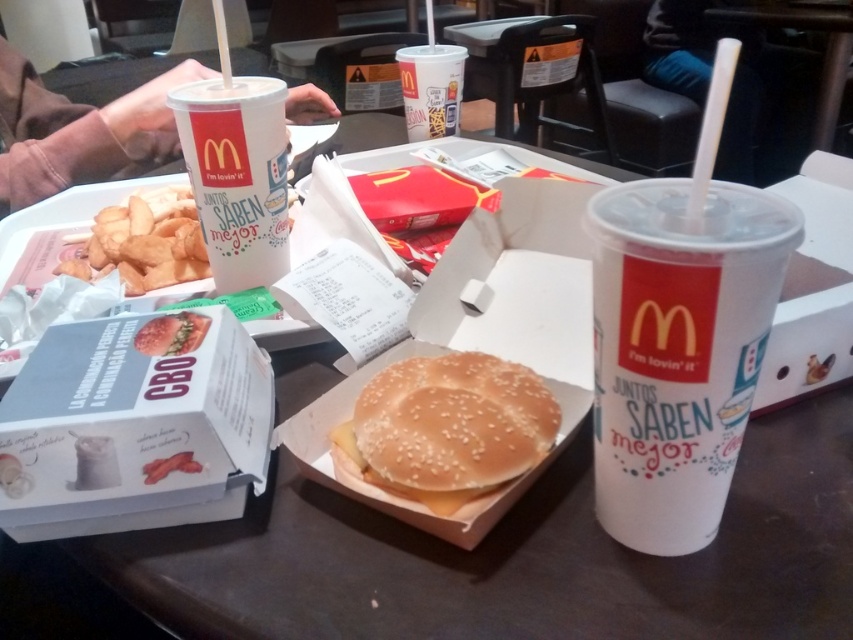
The image size is (853, 640). What do you see at coordinates (677, 349) in the screenshot?
I see `white paper cup at center` at bounding box center [677, 349].

Is white paper cup at center smaller than sesame seed bun at center?

Actually, white paper cup at center might be larger than sesame seed bun at center.

I want to click on white paper cup at center, so click(x=677, y=349).

Who is positioned more to the left, pink fabric hand at upper left or white paper cup at upper center?

pink fabric hand at upper left is more to the left.

Between point (6, 116) and point (437, 44), which one is positioned behind?

Point (437, 44)

The image size is (853, 640). I want to click on pink fabric hand at upper left, so click(x=79, y=131).

Can you confirm if white paper cup at center is shorter than golden crispy fries at lower left?

In fact, white paper cup at center may be taller than golden crispy fries at lower left.

Can you confirm if white paper cup at center is positioned to the left of golden crispy fries at lower left?

Incorrect, white paper cup at center is not on the left side of golden crispy fries at lower left.

Find the location of a particular element. Image resolution: width=853 pixels, height=640 pixels. white paper cup at center is located at coordinates (677, 349).